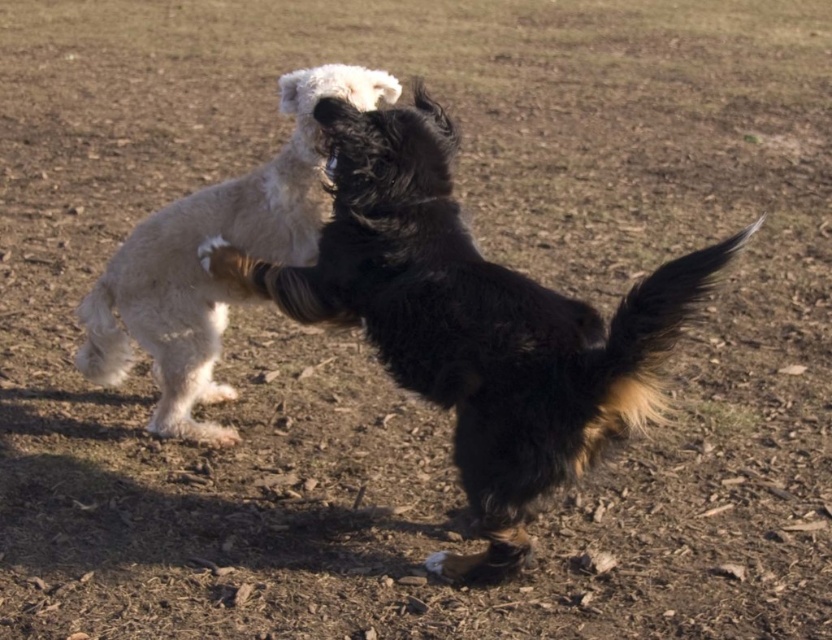
Question: Does fluffy black dog at center have a greater width compared to white fluffy dog at center?

Choices:
 (A) yes
 (B) no

Answer: (A)

Question: Does fluffy black dog at center lie behind white fluffy dog at center?

Choices:
 (A) no
 (B) yes

Answer: (A)

Question: Which object is farther from the camera taking this photo?

Choices:
 (A) white fluffy dog at center
 (B) fluffy black dog at center

Answer: (A)

Question: Which point is farther to the camera?

Choices:
 (A) (166, 339)
 (B) (431, 365)

Answer: (A)

Question: Which point is closer to the camera?

Choices:
 (A) white fluffy dog at center
 (B) fluffy black dog at center

Answer: (B)

Question: Does fluffy black dog at center appear over white fluffy dog at center?

Choices:
 (A) no
 (B) yes

Answer: (A)